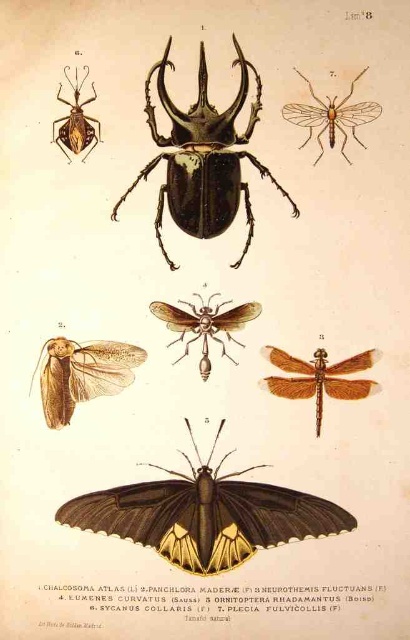
Question: Among these points, which one is farthest from the camera?

Choices:
 (A) (150, 492)
 (B) (259, 305)

Answer: (B)

Question: Can you confirm if glossy black beetle at center is positioned below brown translucent dragonfly at center-right?

Choices:
 (A) yes
 (B) no

Answer: (B)

Question: Does brown matte wasp at center lie behind translucent yellowish wings at upper right?

Choices:
 (A) no
 (B) yes

Answer: (A)

Question: Which of the following is the farthest from the observer?

Choices:
 (A) black glossy butterfly at bottom
 (B) brown translucent dragonfly at center-right

Answer: (B)

Question: Does glossy black beetle at center have a lesser width compared to matte brown beetle at upper left?

Choices:
 (A) no
 (B) yes

Answer: (A)

Question: Estimate the real-world distances between objects in this image. Which object is farther from the brown translucent dragonfly at center-right?

Choices:
 (A) black glossy butterfly at bottom
 (B) matte brown beetle at upper left
 (C) brown matte wasp at center

Answer: (B)